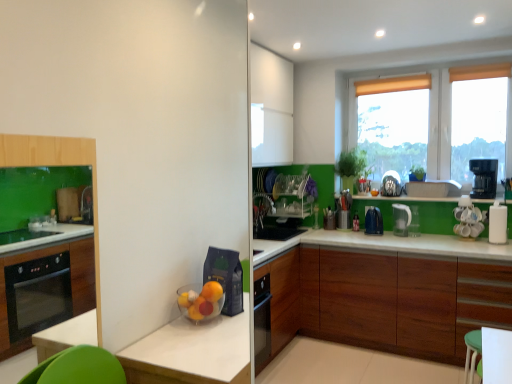
Question: Considering the relative sizes of white glossy paper towel dispenser at right, the fourth appliance viewed from the back, and satin silver kettle at upper right, the third appliance viewed from the front, in the image provided, is white glossy paper towel dispenser at right, the fourth appliance viewed from the back, taller than satin silver kettle at upper right, the third appliance viewed from the front,?

Choices:
 (A) yes
 (B) no

Answer: (A)

Question: Does white glossy paper towel dispenser at right, marked as the 1th appliance in a right-to-left arrangement, contain satin silver kettle at upper right, the third appliance viewed from the front?

Choices:
 (A) no
 (B) yes

Answer: (A)

Question: Considering the relative positions of white glossy paper towel dispenser at right, the 1th appliance viewed from the front, and satin silver kettle at upper right, the third appliance viewed from the front, in the image provided, is white glossy paper towel dispenser at right, the 1th appliance viewed from the front, to the right of satin silver kettle at upper right, the third appliance viewed from the front, from the viewer's perspective?

Choices:
 (A) yes
 (B) no

Answer: (A)

Question: Is white glossy paper towel dispenser at right, the fourth appliance viewed from the back, next to satin silver kettle at upper right, the third appliance from the right?

Choices:
 (A) no
 (B) yes

Answer: (A)

Question: From the image's perspective, is white glossy paper towel dispenser at right, the fourth appliance viewed from the back, on satin silver kettle at upper right, the third appliance viewed from the front?

Choices:
 (A) no
 (B) yes

Answer: (A)

Question: From the image's perspective, is white glossy paper towel dispenser at right, the 4th appliance in the left-to-right sequence, located beneath satin silver kettle at upper right, the third appliance from the right?

Choices:
 (A) no
 (B) yes

Answer: (B)

Question: Could wooden cabinet at lower right be considered to be inside black plastic coffee maker at upper right, the third kitchen appliance from the left?

Choices:
 (A) yes
 (B) no

Answer: (B)

Question: From a real-world perspective, is black plastic coffee maker at upper right, the third kitchen appliance from the left, on wooden cabinet at lower right?

Choices:
 (A) no
 (B) yes

Answer: (B)

Question: Is black plastic coffee maker at upper right, arranged as the first kitchen appliance when viewed from the right, bigger than wooden cabinet at lower right?

Choices:
 (A) no
 (B) yes

Answer: (A)

Question: Is black plastic coffee maker at upper right, the third kitchen appliance from the left, closer to the viewer compared to wooden cabinet at lower right?

Choices:
 (A) no
 (B) yes

Answer: (A)

Question: Is black plastic coffee maker at upper right, the third kitchen appliance from the left, to the right of wooden cabinet at lower right from the viewer's perspective?

Choices:
 (A) no
 (B) yes

Answer: (B)

Question: Is black plastic coffee maker at upper right, the third kitchen appliance from the left, facing towards wooden cabinet at lower right?

Choices:
 (A) no
 (B) yes

Answer: (A)

Question: Can you confirm if translucent plastic window at upper right is shorter than satin silver kettle at upper right, which is the second appliance from back to front?

Choices:
 (A) yes
 (B) no

Answer: (B)